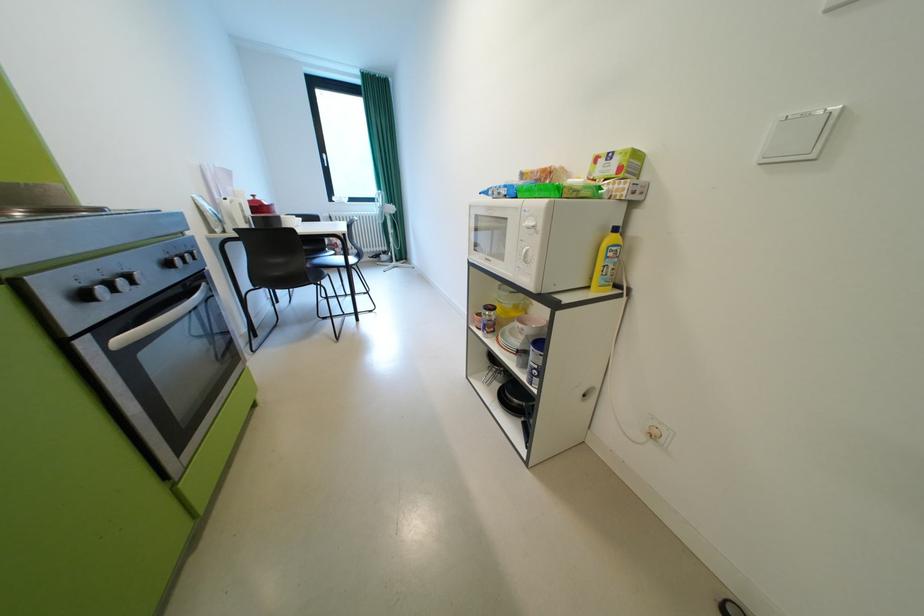
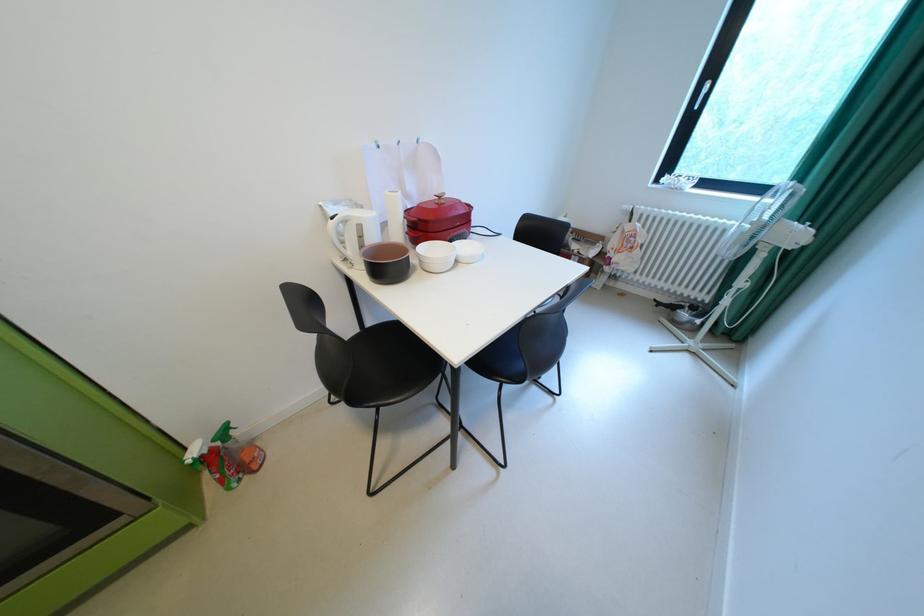
Locate, in the second image, the point that corresponds to point (263, 197) in the first image.

(450, 198)